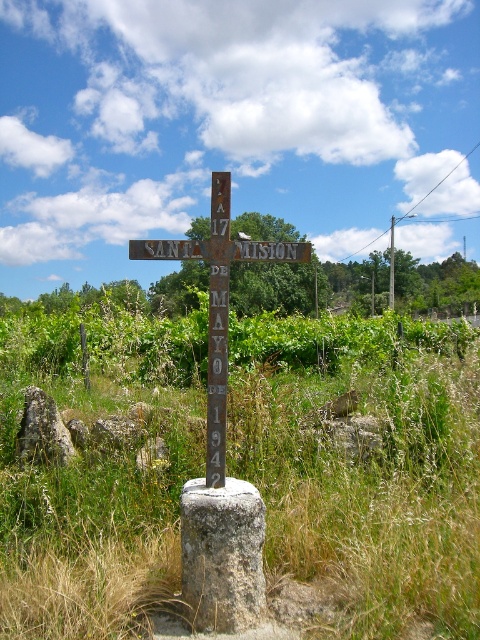
Question: Does green grass at center come in front of rusty metal cross at center?

Choices:
 (A) yes
 (B) no

Answer: (B)

Question: Estimate the real-world distances between objects in this image. Which object is closer to the rusty metal cross at center?

Choices:
 (A) gray rough stone at center
 (B) green grass at center
 (C) brown wooden pole at center

Answer: (A)

Question: Is green grass at center to the left of brown wooden pole at center from the viewer's perspective?

Choices:
 (A) no
 (B) yes

Answer: (B)

Question: Which of the following is the farthest from the observer?

Choices:
 (A) gray rough stone at center
 (B) rusty metal cross at center
 (C) green grass at center
 (D) brown wooden pole at center

Answer: (D)

Question: Can you confirm if gray rough stone at center is bigger than rusty metal cross at center?

Choices:
 (A) no
 (B) yes

Answer: (A)

Question: Which point is closer to the camera taking this photo?

Choices:
 (A) (394, 248)
 (B) (220, 515)
 (C) (25, 536)

Answer: (B)